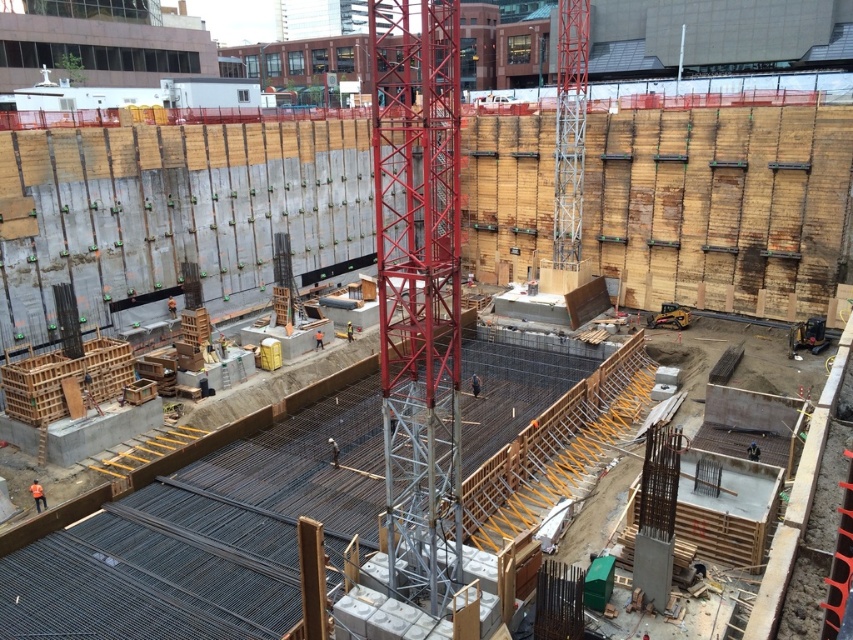
Who is positioned more to the left, concrete rebar at center or metallic red tower crane at center?

From the viewer's perspective, metallic red tower crane at center appears more on the left side.

Who is shorter, concrete rebar at center or metallic red tower crane at center?

With less height is concrete rebar at center.

Between point (790, 426) and point (372, 122), which one is positioned behind?

The point (372, 122) is more distant.

Locate an element on the screen. The width and height of the screenshot is (853, 640). concrete rebar at center is located at coordinates (199, 529).